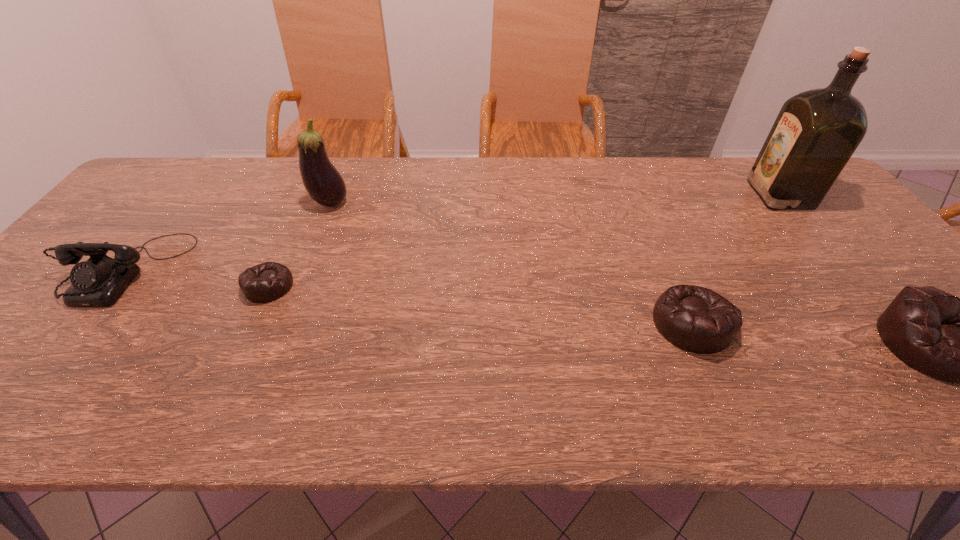
Where is `free space at the far edge of the desktop`? The height and width of the screenshot is (540, 960). free space at the far edge of the desktop is located at coordinates pyautogui.click(x=243, y=163).

The height and width of the screenshot is (540, 960). Find the location of `vacant space at the near edge`. vacant space at the near edge is located at coordinates (815, 348).

The image size is (960, 540). Identify the location of vacant area at the left edge. click(x=115, y=219).

In order to click on vacant space at the far left corner of the desktop in this screenshot , I will do `click(159, 178)`.

I want to click on vacant space at the near left corner of the desktop, so click(57, 351).

Locate an element on the screen. blank region between the liquor and the second beanbag from left to right is located at coordinates (735, 259).

At what (x,y) coordinates should I click in order to perform the action: click on empty space that is in between the shortest object and the eggplant. Please return your answer as a coordinate pair (x, y). Looking at the image, I should click on (300, 244).

Locate an element on the screen. This screenshot has width=960, height=540. free spot between the liquor and the third object from right to left is located at coordinates (735, 259).

You are a GUI agent. You are given a task and a screenshot of the screen. Output one action in this format:
    pyautogui.click(x=<x>, y=<y>)
    Task: Click on the vacant area that lies between the fifth shortest object and the telephone
    This screenshot has width=960, height=540.
    Given the screenshot: What is the action you would take?
    pyautogui.click(x=228, y=235)

Where is `vacant point located between the telephone and the second beanbag from right to left`? Image resolution: width=960 pixels, height=540 pixels. vacant point located between the telephone and the second beanbag from right to left is located at coordinates (408, 296).